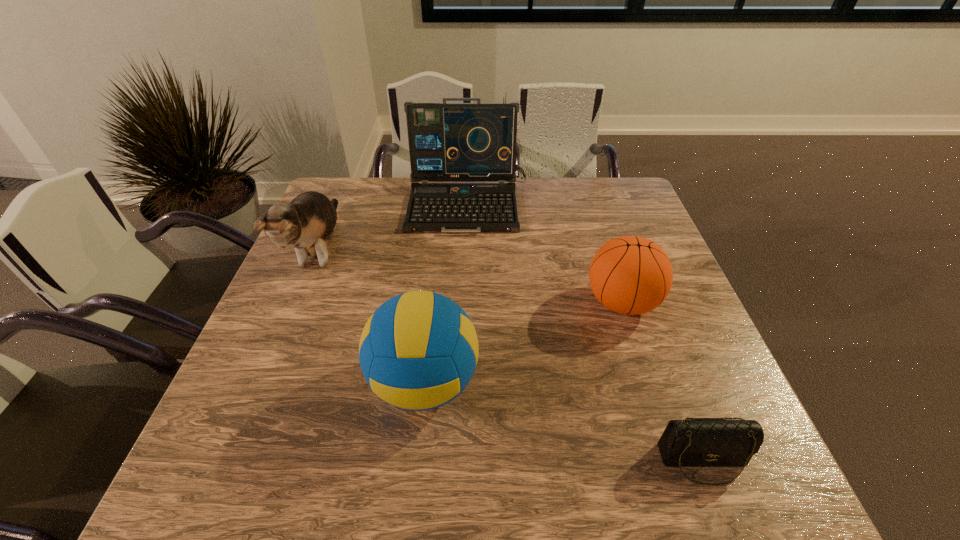
What are the coordinates of `vacant space that is in between the basketball and the nearest object` in the screenshot? It's located at (662, 381).

In order to click on vacant space in between the laptop computer and the shortest object in this screenshot , I will do `click(586, 333)`.

Where is `vacant area that lies between the second shortest object and the shortest object`? This screenshot has width=960, height=540. vacant area that lies between the second shortest object and the shortest object is located at coordinates (662, 381).

Image resolution: width=960 pixels, height=540 pixels. Find the location of `vacant point located between the tallest object and the volleyball`. vacant point located between the tallest object and the volleyball is located at coordinates (446, 294).

Select which object is the third closest to the leftmost object. Please provide its 2D coordinates. Your answer should be formatted as a tuple, i.e. [(x, y)], where the tuple contains the x and y coordinates of a point satisfying the conditions above.

[(631, 275)]

Choose which object is the third nearest neighbor to the volleyball. Please provide its 2D coordinates. Your answer should be formatted as a tuple, i.e. [(x, y)], where the tuple contains the x and y coordinates of a point satisfying the conditions above.

[(700, 442)]

The height and width of the screenshot is (540, 960). I want to click on blank space that satisfies the following two spatial constraints: 1. at the face of the leftmost object; 2. on the right side of the basketball, so click(x=298, y=302).

Locate an element on the screen. vacant space that satisfies the following two spatial constraints: 1. at the face of the volleyball; 2. on the left side of the cat is located at coordinates (263, 383).

Where is `vacant region that satisfies the following two spatial constraints: 1. at the face of the second shortest object; 2. on the right side of the leftmost object`? The height and width of the screenshot is (540, 960). vacant region that satisfies the following two spatial constraints: 1. at the face of the second shortest object; 2. on the right side of the leftmost object is located at coordinates (298, 302).